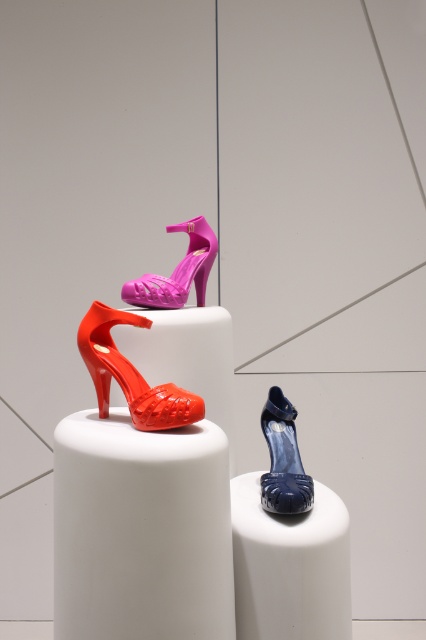
Question: Where is rubber-like red high-heeled shoe at left located in relation to glossy blue high-heeled shoe at center in the image?

Choices:
 (A) left
 (B) right

Answer: (A)

Question: Among these objects, which one is nearest to the camera?

Choices:
 (A) glossy blue high-heeled shoe at center
 (B) rubber-like red high-heeled shoe at left

Answer: (B)

Question: Is glossy blue high-heeled shoe at center smaller than pink matte sandal at center?

Choices:
 (A) no
 (B) yes

Answer: (B)

Question: Does rubber-like red high-heeled shoe at left appear on the right side of pink matte sandal at center?

Choices:
 (A) no
 (B) yes

Answer: (A)

Question: Which of the following is the farthest from the observer?

Choices:
 (A) rubber-like red high-heeled shoe at left
 (B) pink matte sandal at center
 (C) glossy blue high-heeled shoe at center

Answer: (B)

Question: Estimate the real-world distances between objects in this image. Which object is farther from the glossy blue high-heeled shoe at center?

Choices:
 (A) rubber-like red high-heeled shoe at left
 (B) pink matte sandal at center

Answer: (B)